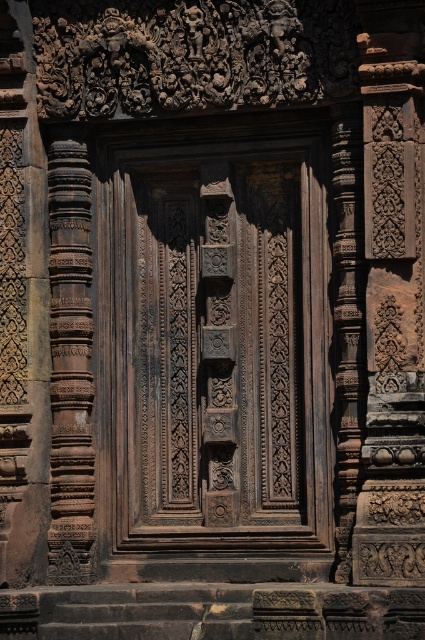
Consider the image. You are a tour guide standing in front of the dark brown wood door at center. You want to explain the distance between the door and the nearest column. However, you forgot the exact distance. Can you determine if the door is closer to the columns than 30 feet?

The dark brown wood door at center is 28.35 feet from viewer, so yes, the door is closer to the columns than 30 feet.

You are an architect examining the stone structure. You need to determine the spatial relationship between the dark brown wood door at center and the brown carved pillar at left. Which object is closer to the viewer?

The dark brown wood door at center is closer to the viewer than the brown carved pillar at left because it is positioned in front of it.